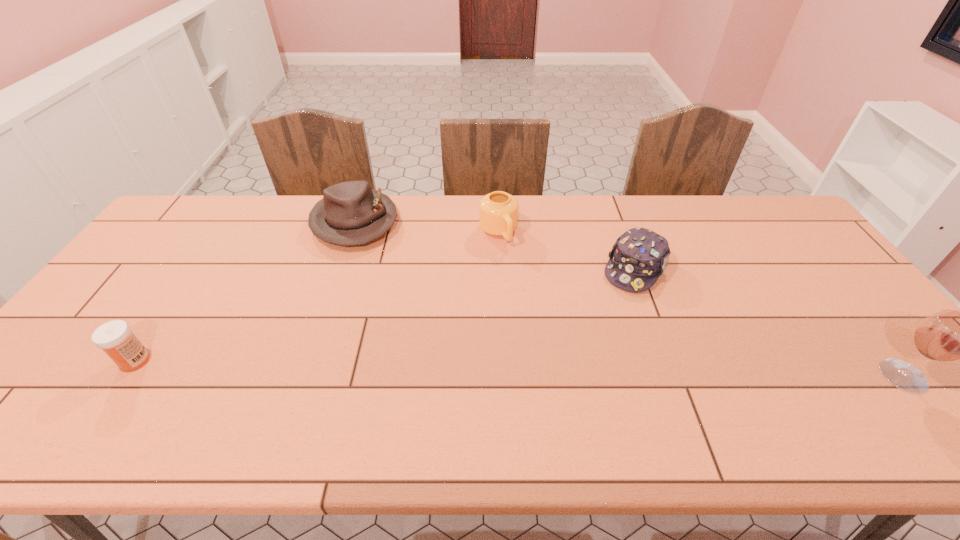
Identify the location of vacant space on the desktop that is between the medicine and the tallest object and is positioned on the handle side of the third object from left to right. This screenshot has height=540, width=960. (579, 369).

I want to click on free spot on the desktop that is between the leftmost object and the rightmost object and is positioned on the decorative side of the hat, so click(404, 366).

What are the coordinates of `vacant space on the desktop that is between the leftmost object and the tallest object and is positioned on the front-facing side of the second object from right to left` in the screenshot? It's located at pos(567,369).